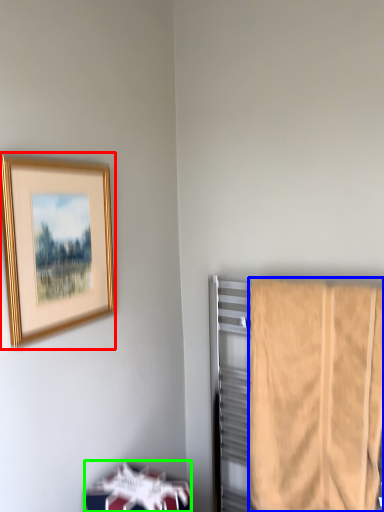
Question: Which object is positioned closest to picture frame (highlighted by a red box)? Select from towel (highlighted by a blue box) and furniture (highlighted by a green box).

Choices:
 (A) towel
 (B) furniture

Answer: (B)